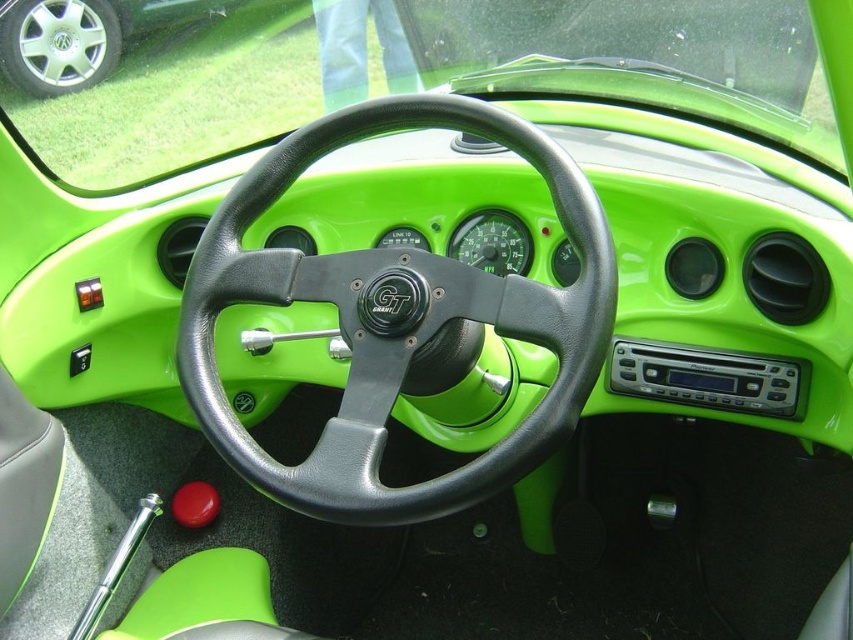
You are a car designer evaluating the placement of controls on the steering wheel. You notice the black leather steering wheel at center and the silver metallic wheel at upper left. Which one has a larger width?

The black leather steering wheel at center has a larger width than the silver metallic wheel at upper left.

You are a delivery robot with a 3.5 feet wide package. You need to navigate through the space between the black leather steering wheel at center and the silver metallic wheel at upper left in the vehicle. Can you fit your package through the space between them?

The distance between the black leather steering wheel at center and the silver metallic wheel at upper left is 3.41 feet, which is slightly less than the 3.5 feet width of the package. Therefore, the package cannot fit through the space between them.

You are sitting in the driver seat of the vehicle and want to adjust the climate control. The controls are located on the silver metallic wheel at upper left. To reach them, do you need to move your hand from the black leather steering wheel at center upwards or downwards?

The black leather steering wheel at center is below the silver metallic wheel at upper left, so you need to move your hand upwards to reach the silver metallic wheel at upper left.